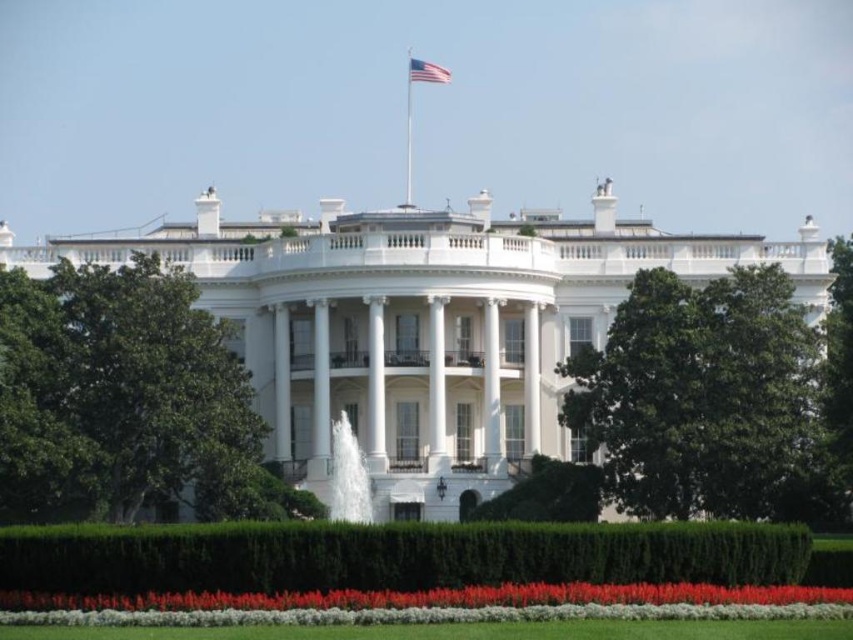
Does point (726, 556) come farther from viewer compared to point (767, 636)?

Yes, it is.

Does green leafy hedge at lower center have a larger size compared to green grass at lower center?

Yes.

Is point (306, 564) positioned behind point (755, 630)?

Yes, point (306, 564) is behind point (755, 630).

You are a GUI agent. You are given a task and a screenshot of the screen. Output one action in this format:
    pyautogui.click(x=<x>, y=<y>)
    Task: Click on the green leafy hedge at lower center
    This screenshot has height=640, width=853.
    Given the screenshot: What is the action you would take?
    pyautogui.click(x=393, y=556)

Does green leafy hedge at center appear under metallic flag pole at upper center?

Yes.

Who is more distant from viewer, (532, 461) or (410, 84)?

The point (410, 84) is behind.

Locate an element on the screen. green leafy hedge at center is located at coordinates (547, 493).

Which is behind, point (405, 170) or point (418, 72)?

The point (405, 170) is more distant.

Is point (412, 77) farther from camera compared to point (422, 60)?

No, it is not.

Where is `metallic flag pole at upper center`? The width and height of the screenshot is (853, 640). metallic flag pole at upper center is located at coordinates (408, 131).